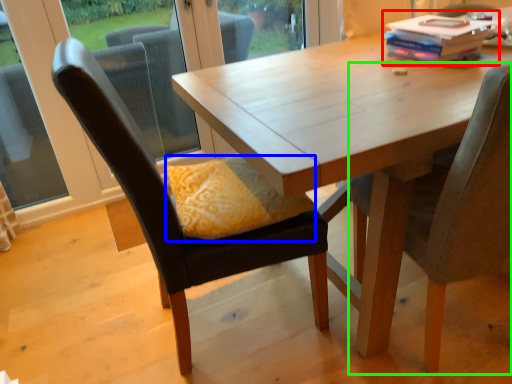
Question: Based on their relative distances, which object is farther from book (highlighted by a red box)? Choose from pillow (highlighted by a blue box) and chair (highlighted by a green box).

Choices:
 (A) pillow
 (B) chair

Answer: (A)